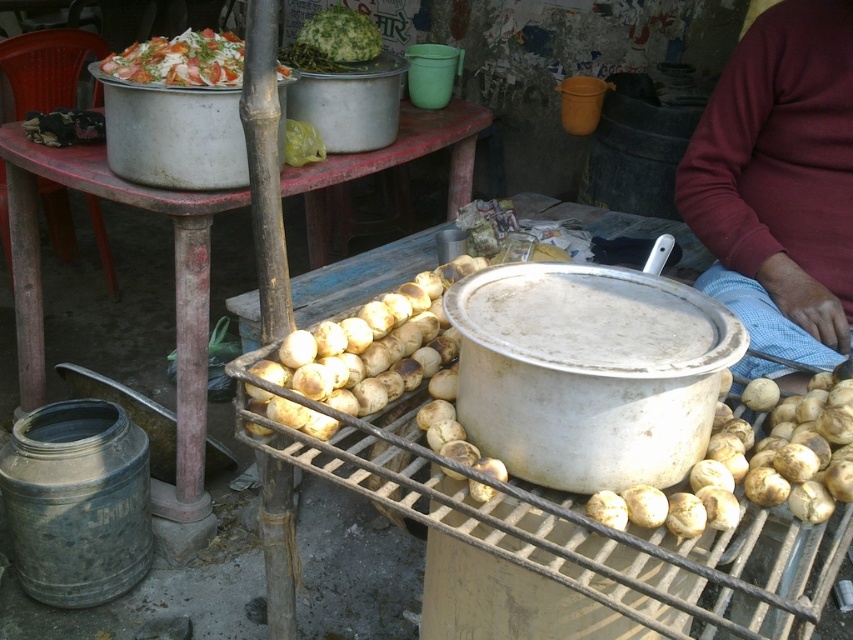
Question: Which object is farther from the camera taking this photo?

Choices:
 (A) white creamy salad at upper left
 (B) green leafymaterial/texture at upper center
 (C) brown matte potatoes at center

Answer: (B)

Question: Which object is farther from the camera taking this photo?

Choices:
 (A) white matte potatoes at center
 (B) white creamy salad at upper left

Answer: (B)

Question: Can you confirm if wooden table at center is smaller than brown matte potatoes at center?

Choices:
 (A) no
 (B) yes

Answer: (A)

Question: Which point is farther to the camera?

Choices:
 (A) wooden table at center
 (B) white creamy salad at upper left
 (C) brown matte potatoes at center
 (D) white matte potatoes at center

Answer: (A)

Question: Is the position of wooden table at center more distant than that of white creamy salad at upper left?

Choices:
 (A) yes
 (B) no

Answer: (A)

Question: Does wooden table at center come behind brown matte potatoes at center?

Choices:
 (A) yes
 (B) no

Answer: (A)